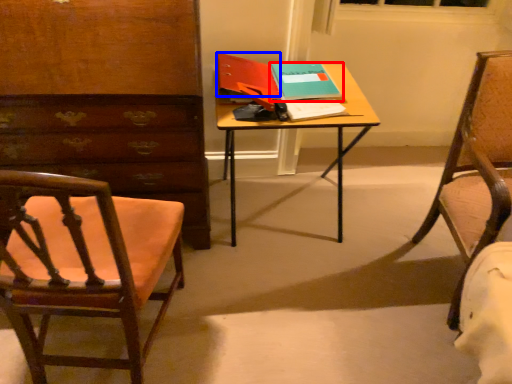
Question: Which object appears closest to the camera in this image, book (highlighted by a red box) or book (highlighted by a blue box)?

Choices:
 (A) book
 (B) book

Answer: (B)